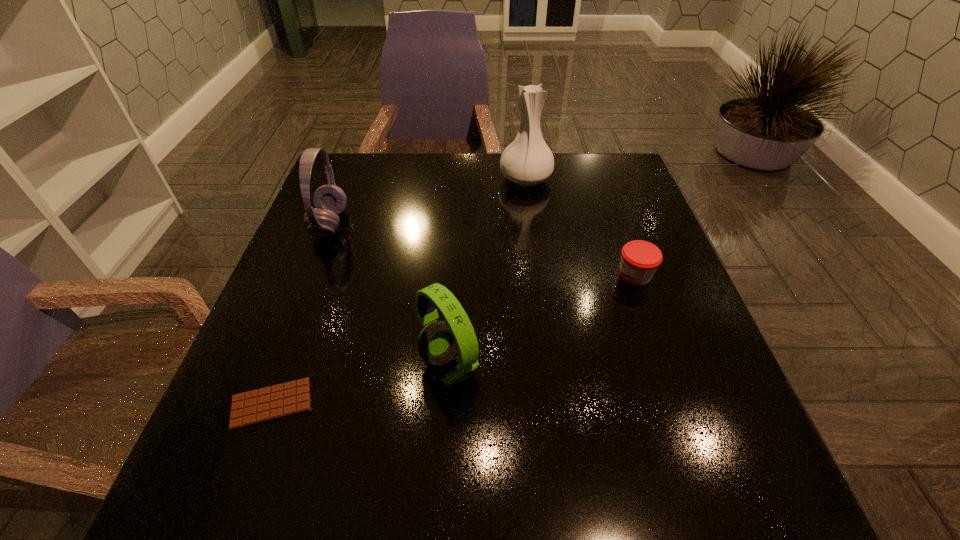
In order to click on free space between the shortest object and the third object from right to left in this screenshot , I will do `click(360, 385)`.

Identify the location of blank region between the left headset and the right headset. Image resolution: width=960 pixels, height=540 pixels. (390, 295).

Where is `vacant area that lies between the third nearest object and the vase`? This screenshot has width=960, height=540. vacant area that lies between the third nearest object and the vase is located at coordinates (580, 227).

Locate an element on the screen. the second closest object to the vase is located at coordinates (329, 200).

Locate an element on the screen. The width and height of the screenshot is (960, 540). the second closest object to the jam is located at coordinates (438, 343).

Locate an element on the screen. The image size is (960, 540). vacant position in the image that satisfies the following two spatial constraints: 1. on the headband and ear cups of the third object from right to left; 2. on the right side of the farther headset is located at coordinates (276, 366).

Locate an element on the screen. This screenshot has height=540, width=960. vacant position in the image that satisfies the following two spatial constraints: 1. on the headband and ear cups of the left headset; 2. on the left side of the third object from right to left is located at coordinates (276, 366).